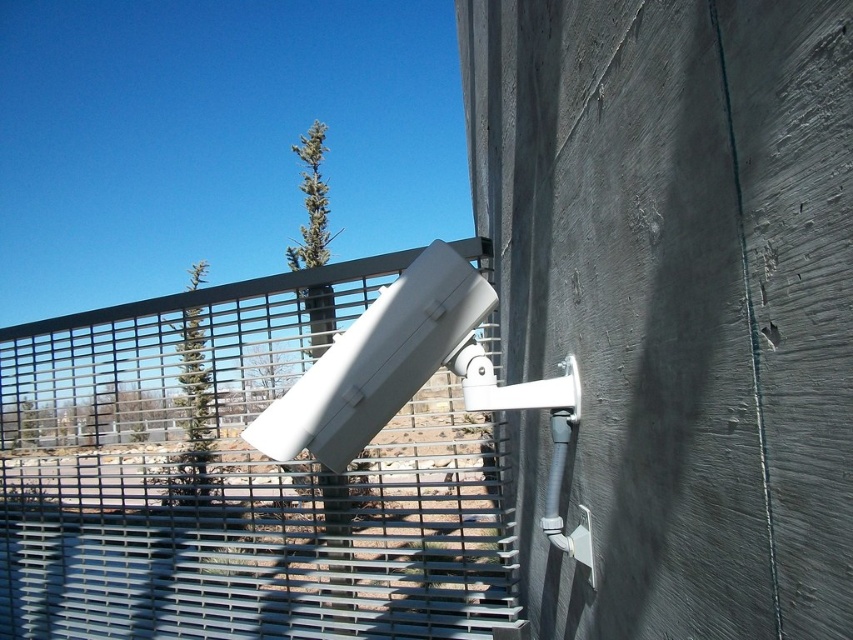
Question: Does metallic gray fence at upper center have a greater width compared to gray metal blind at lower left?

Choices:
 (A) no
 (B) yes

Answer: (B)

Question: Which point is closer to the camera?

Choices:
 (A) (109, 392)
 (B) (491, 612)

Answer: (B)

Question: Is metallic gray fence at upper center bigger than gray metal blind at lower left?

Choices:
 (A) yes
 (B) no

Answer: (A)

Question: Which point appears closest to the camera in this image?

Choices:
 (A) (386, 634)
 (B) (285, 547)

Answer: (A)

Question: Can you confirm if metallic gray fence at upper center is positioned below gray metal blind at lower left?

Choices:
 (A) no
 (B) yes

Answer: (A)